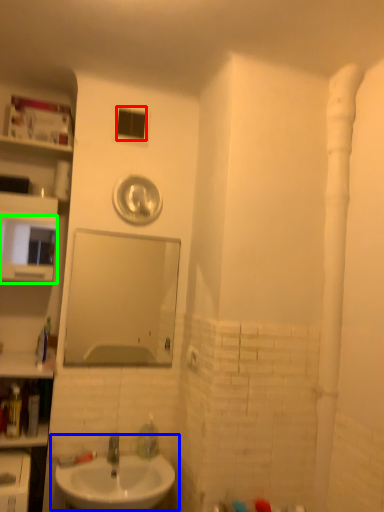
Question: Which object is positioned closest to window (highlighted by a red box)? Select from sink (highlighted by a blue box) and medicine cabinet (highlighted by a green box).

Choices:
 (A) sink
 (B) medicine cabinet

Answer: (B)